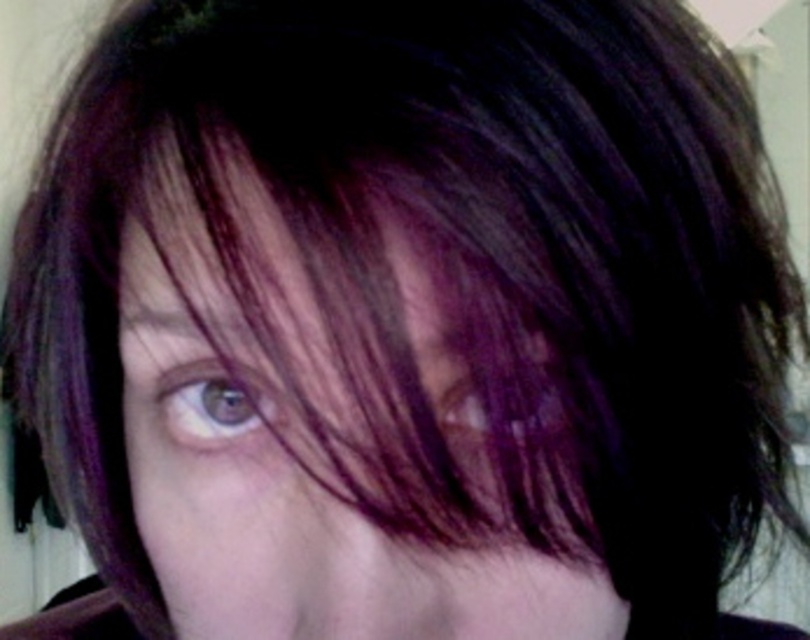
Question: Which point is closer to the camera taking this photo?

Choices:
 (A) (514, 588)
 (B) (522, 429)
 (C) (237, 392)

Answer: (B)

Question: Estimate the real-world distances between objects in this image. Which object is closer to the purple shiny hair at center?

Choices:
 (A) purple hair at center
 (B) brown matte eye at center

Answer: (A)

Question: Does brown matte eye at center have a greater width compared to purple shiny hair at center?

Choices:
 (A) yes
 (B) no

Answer: (A)

Question: Can you confirm if purple hair at center is smaller than purple shiny hair at center?

Choices:
 (A) no
 (B) yes

Answer: (A)

Question: Which object appears farthest from the camera in this image?

Choices:
 (A) purple shiny hair at center
 (B) brown matte eye at center

Answer: (B)

Question: Is purple hair at center bigger than brown matte eye at center?

Choices:
 (A) yes
 (B) no

Answer: (A)